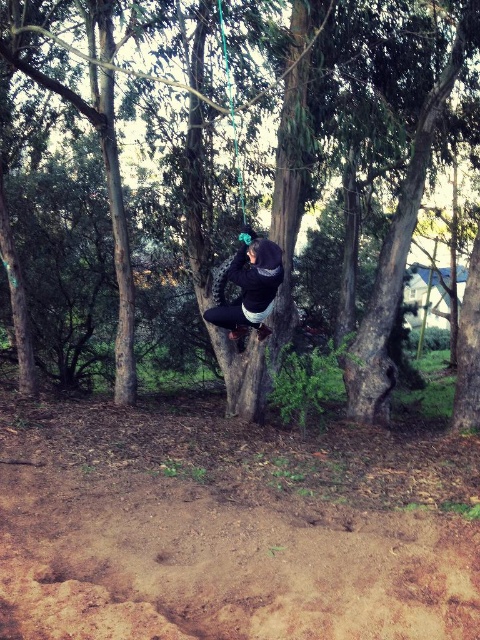
You are a hiker who has just arrived at this wooded area. You see a brown rough tree trunk at center and a dark blue fleece jacket at center. Which object is closer to you?

The brown rough tree trunk at center is closer to the viewer than the dark blue fleece jacket at center.

You are a hiker who has just arrived at this wooded area. You notice a brown rough tree trunk at center and a dark blue fleece jacket at center. Which object is smaller in size?

The brown rough tree trunk at center is smaller in size compared to the dark blue fleece jacket at center.